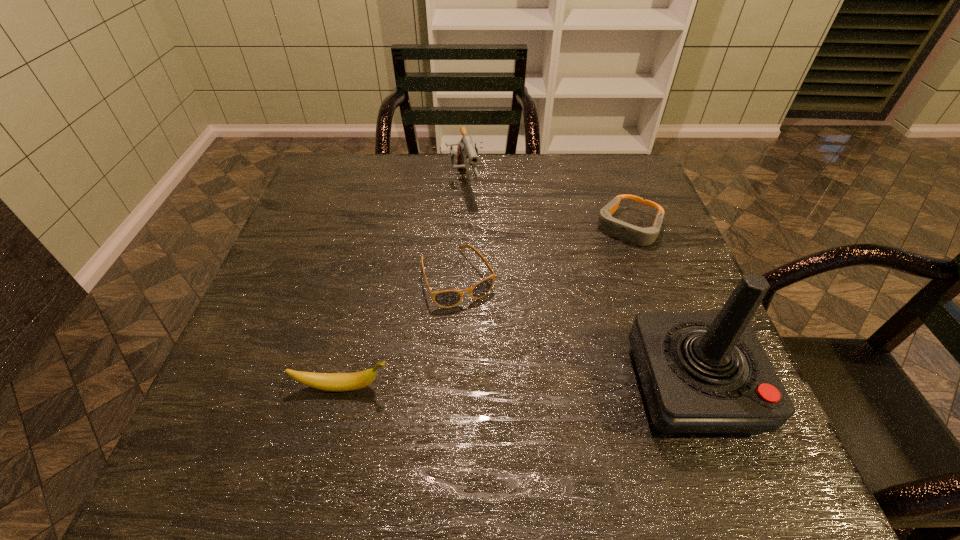
Identify the location of free space on the desktop that is between the leftmost object and the joystick and is positioned on the front-facing side of the sunglasses. (515, 387).

The image size is (960, 540). What are the coordinates of `vacant spot on the desktop that is between the third tallest object and the joystick and is positioned on the front and back of the goggles` in the screenshot? It's located at (524, 387).

Locate an element on the screen. The height and width of the screenshot is (540, 960). free spot on the desktop that is between the third tallest object and the tallest object and is positioned at the barrel end of the gun is located at coordinates (520, 387).